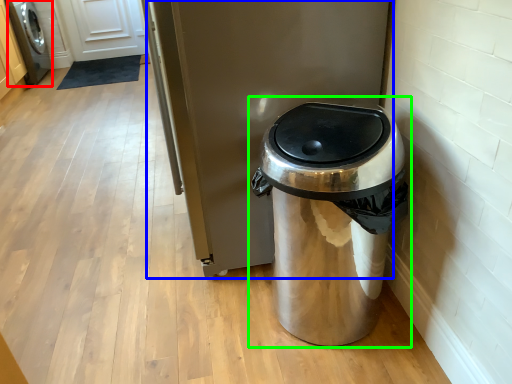
Question: Which object is positioned closest to washing machine (highlighted by a red box)? Select from appliance (highlighted by a blue box) and waste container (highlighted by a green box).

Choices:
 (A) appliance
 (B) waste container

Answer: (A)